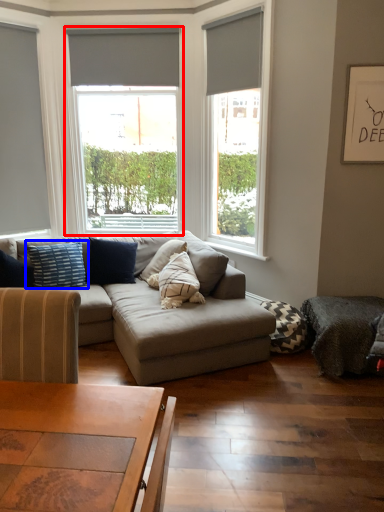
Question: Which point is further to the camera, window (highlighted by a red box) or pillow (highlighted by a blue box)?

Choices:
 (A) window
 (B) pillow

Answer: (A)